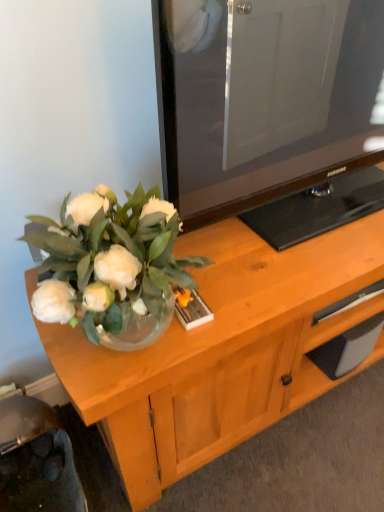
Question: Would you say black rubber drawer at lower right is to the left or to the right of metallic silver swivel chair at lower left in the picture?

Choices:
 (A) left
 (B) right

Answer: (B)

Question: Is black rubber drawer at lower right taller or shorter than metallic silver swivel chair at lower left?

Choices:
 (A) short
 (B) tall

Answer: (A)

Question: Which object is positioned closest to the black rubber drawer at lower right?

Choices:
 (A) metallic silver swivel chair at lower left
 (B) wooden cabinet at center

Answer: (B)

Question: Which object is the closest to the black rubber drawer at lower right?

Choices:
 (A) wooden cabinet at center
 (B) metallic silver swivel chair at lower left

Answer: (A)